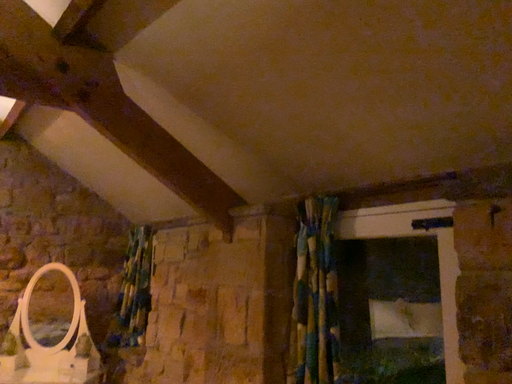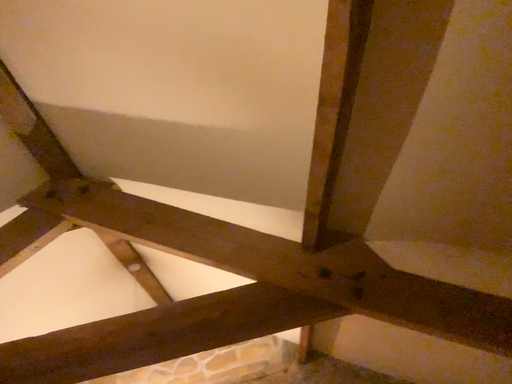
Question: How did the camera likely rotate when shooting the video?

Choices:
 (A) rotated left
 (B) rotated right

Answer: (A)